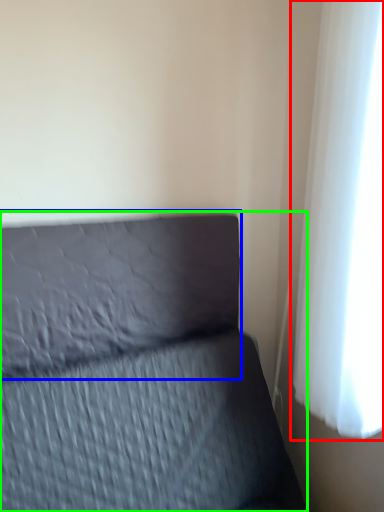
Question: Which is nearer to the curtain (highlighted by a red box)? pillow (highlighted by a blue box) or furniture (highlighted by a green box).

Choices:
 (A) pillow
 (B) furniture

Answer: (B)